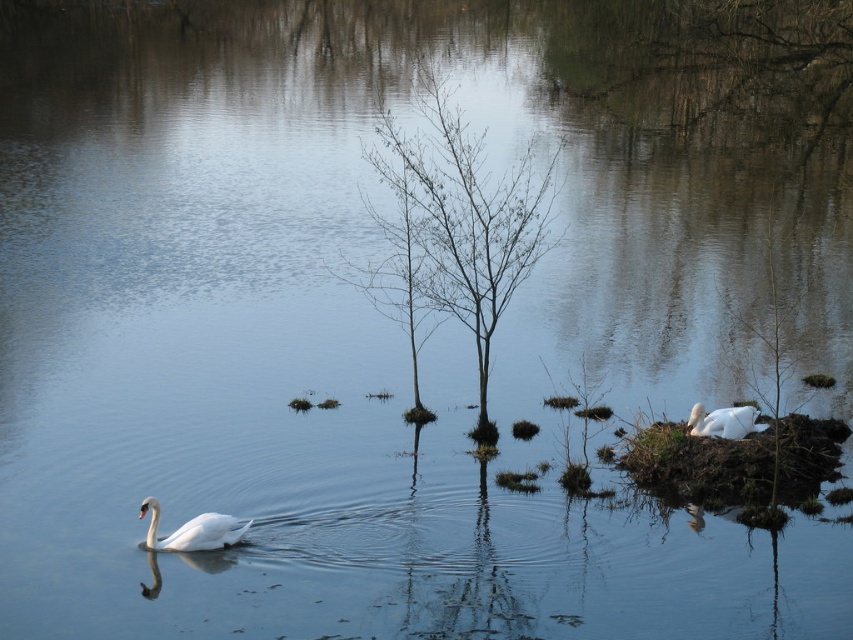
Question: Which is farther from the bare branches at center?

Choices:
 (A) white glossy swan at left
 (B) white matte swan at lower right

Answer: (A)

Question: Does bare branches at center appear on the left side of white matte swan at lower right?

Choices:
 (A) no
 (B) yes

Answer: (B)

Question: Which of these objects is positioned farthest from the bare branches at center?

Choices:
 (A) white glossy swan at left
 (B) white matte swan at lower right

Answer: (A)

Question: Based on their relative distances, which object is nearer to the white matte swan at lower right?

Choices:
 (A) white glossy swan at left
 (B) bare branches at center

Answer: (A)

Question: Is bare branches at center thinner than white glossy swan at left?

Choices:
 (A) no
 (B) yes

Answer: (A)

Question: Can you confirm if bare branches at center is positioned to the left of white matte swan at lower right?

Choices:
 (A) yes
 (B) no

Answer: (A)